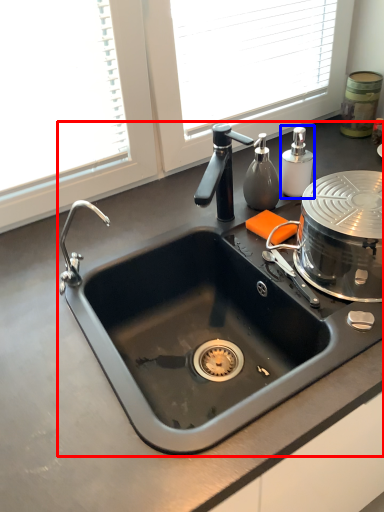
Question: Which object is closer to the camera taking this photo, sink (highlighted by a red box) or soap dispenser (highlighted by a blue box)?

Choices:
 (A) sink
 (B) soap dispenser

Answer: (A)